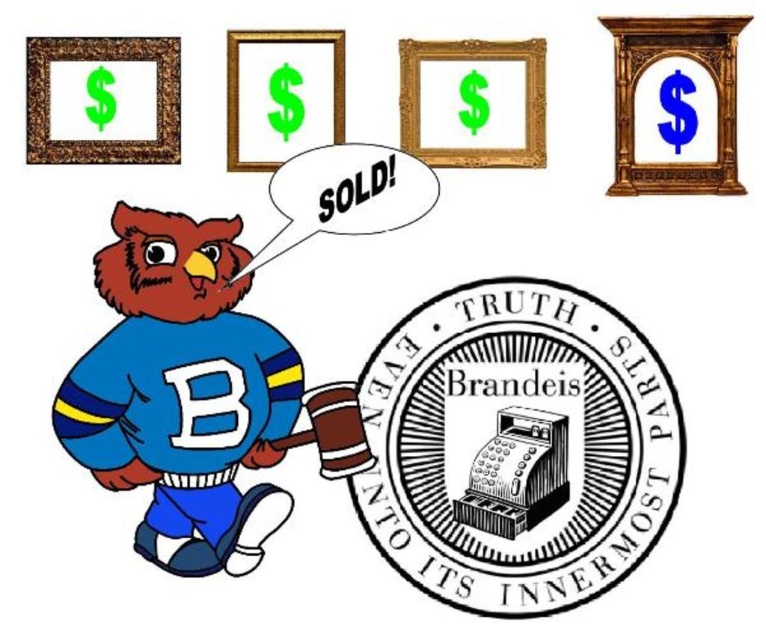
You are an art installer setting up this collage. You need to hang the gold wooden frame at upper right and the black paper at upper center on a wall. The wall has a space that is 24 inches wide. Will both items fit side by side without overlapping?

The gold wooden frame at upper right and the black paper at upper center are 24.86 inches apart from each other. Since the available space is only 24 inches, they will not fit side by side without overlapping.

Based on the scene described, which object is taller between the gold wooden frame at upper right and the black paper at upper center?

The gold wooden frame at upper right is taller than the black paper at upper center.

You are an art student analyzing the collage. You notice a point at coordinates [182,387]. Based on the scene description, what object is located at this coordinate?

The point at coordinates [182,387] corresponds to the matte blue jersey at lower left.